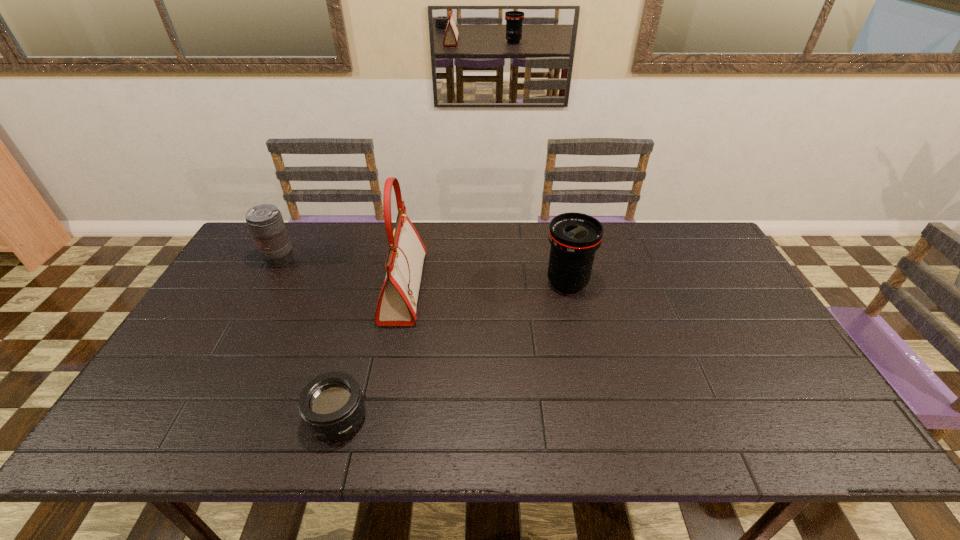
The width and height of the screenshot is (960, 540). What are the coordinates of `the tallest object` in the screenshot? It's located at pyautogui.click(x=396, y=307).

Where is `the rightmost object`? The width and height of the screenshot is (960, 540). the rightmost object is located at coordinates (574, 237).

Identify the location of the leftmost object. (265, 221).

Locate an element on the screen. the shortest object is located at coordinates (331, 405).

Image resolution: width=960 pixels, height=540 pixels. In order to click on the second telephoto lens from left to right in this screenshot , I will do `click(331, 405)`.

I want to click on blank space located on the front of the tallest object, so click(x=389, y=362).

Image resolution: width=960 pixels, height=540 pixels. What are the coordinates of `free region located 0.390m on the front of the rightmost telephoto lens` in the screenshot? It's located at (597, 417).

The height and width of the screenshot is (540, 960). Identify the location of free space located 0.240m on the side of the leftmost telephoto lens where the control switches are located. (244, 326).

Identify the location of handbag situated at the far edge. This screenshot has height=540, width=960. (396, 307).

Image resolution: width=960 pixels, height=540 pixels. I want to click on telephoto lens that is at the far edge, so click(265, 221).